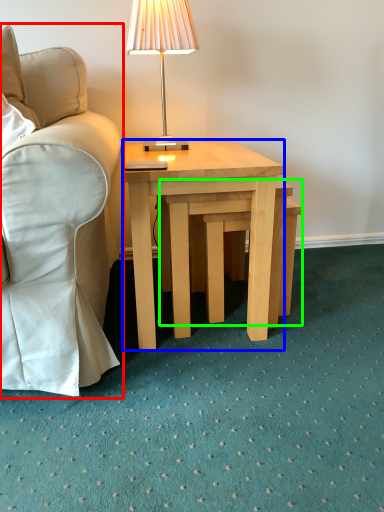
Question: Considering the real-world distances, which object is farthest from chair (highlighted by a red box)? coffee table (highlighted by a blue box) or step stool (highlighted by a green box)?

Choices:
 (A) coffee table
 (B) step stool

Answer: (B)